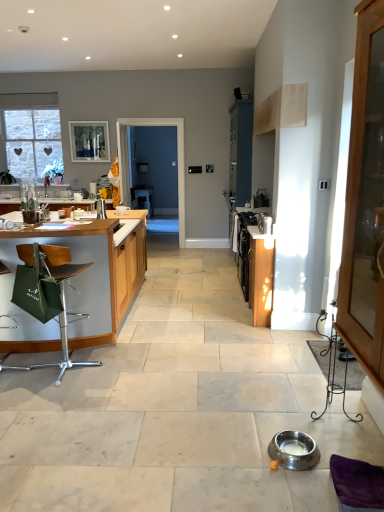
Find the location of a particular element. Image resolution: width=384 pixels, height=512 pixels. blank space situated above stainless steel bowl at lower center, positioned as the first appliance in front-to-back order (from a real-world perspective) is located at coordinates (292, 443).